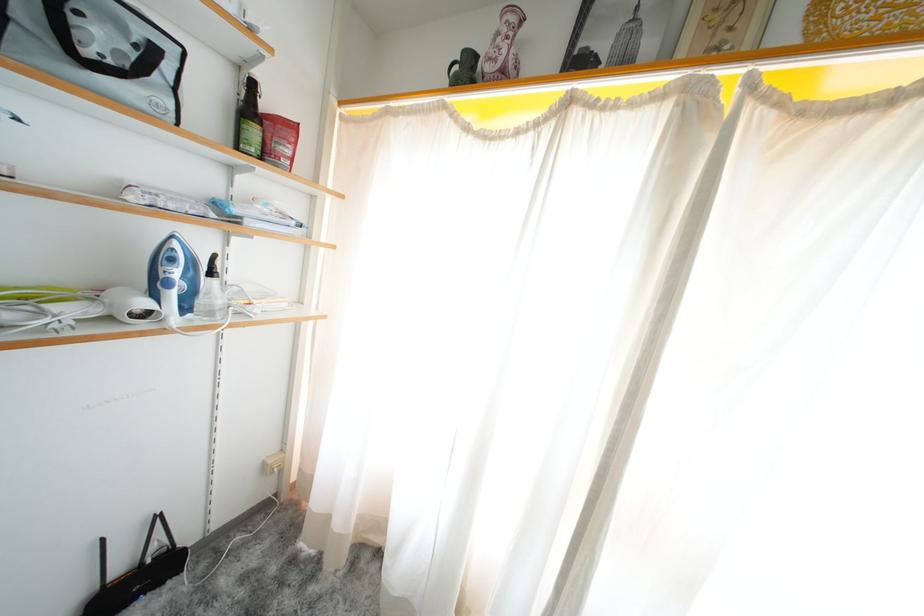
Identify the location of black wifi router. This screenshot has width=924, height=616. (137, 573).